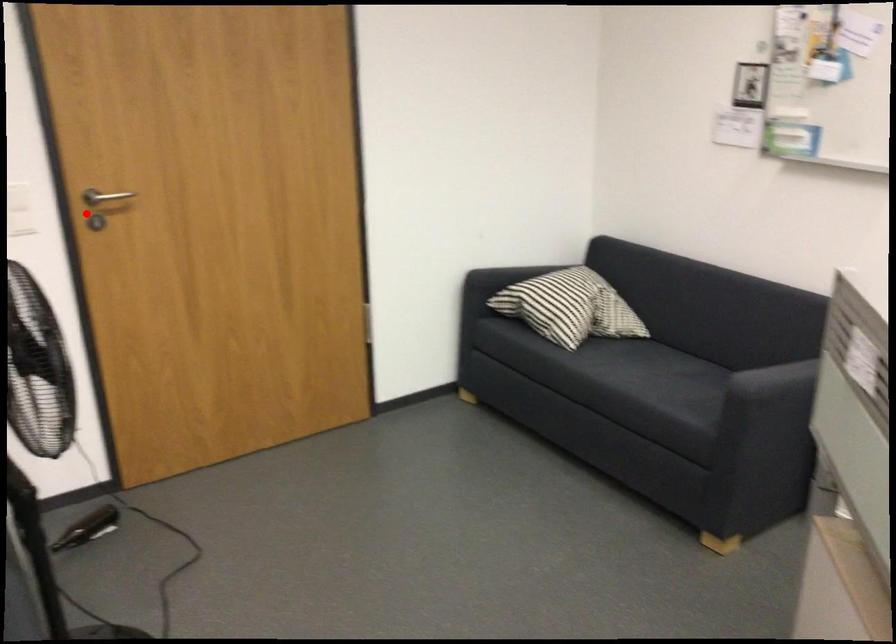
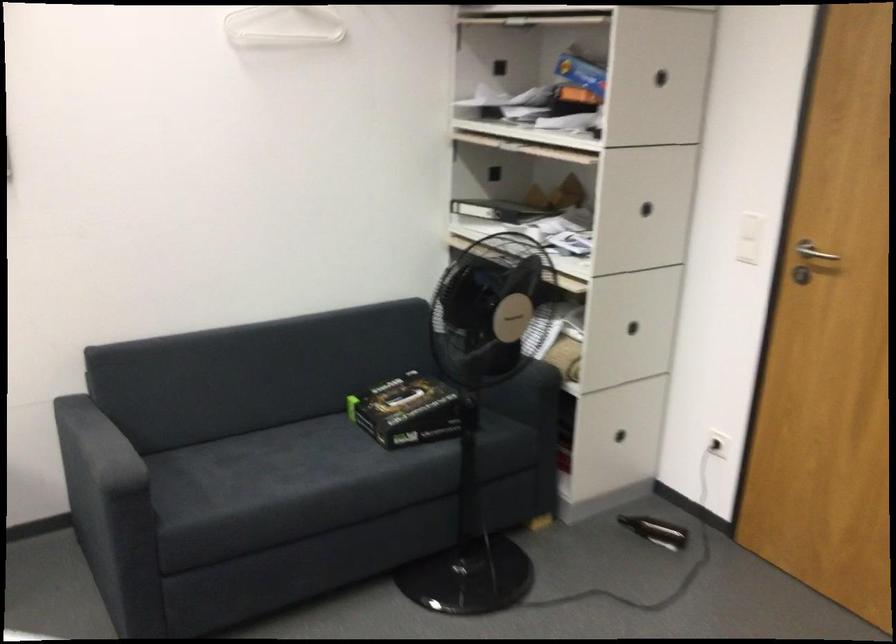
In the second image, find the point that corresponds to the highlighted location in the first image.

(813, 252)